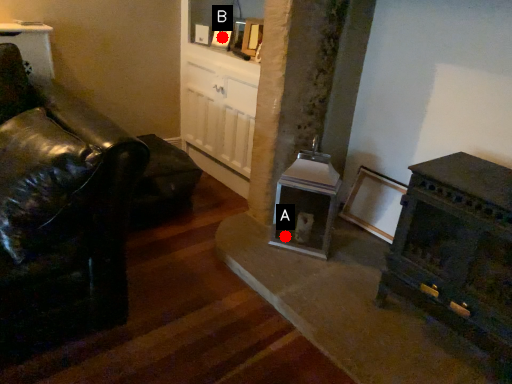
Question: Two points are circled on the image, labeled by A and B beside each circle. Which point is farther from the camera taking this photo?

Choices:
 (A) A is further
 (B) B is further

Answer: (B)